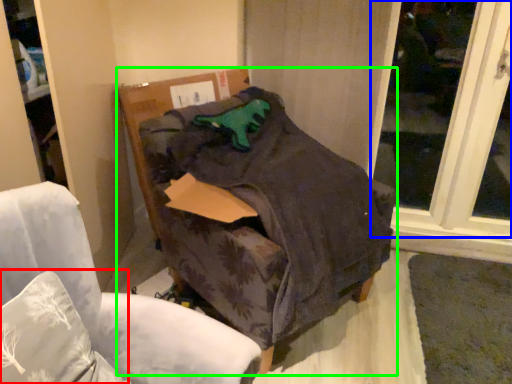
Question: Based on their relative distances, which object is farther from pillow (highlighted by a red box)? Choose from window (highlighted by a blue box) and furniture (highlighted by a green box).

Choices:
 (A) window
 (B) furniture

Answer: (A)